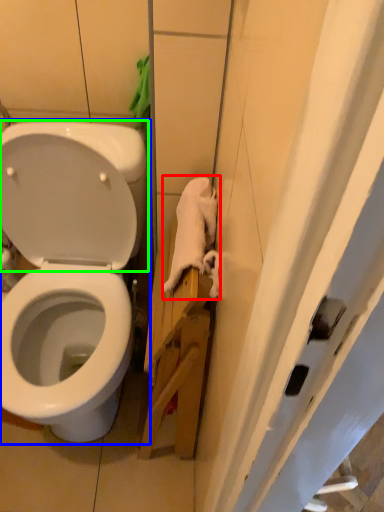
Question: Which is farther away from material (highlighted by a red box)? toilet (highlighted by a blue box) or back (highlighted by a green box)?

Choices:
 (A) toilet
 (B) back

Answer: (A)